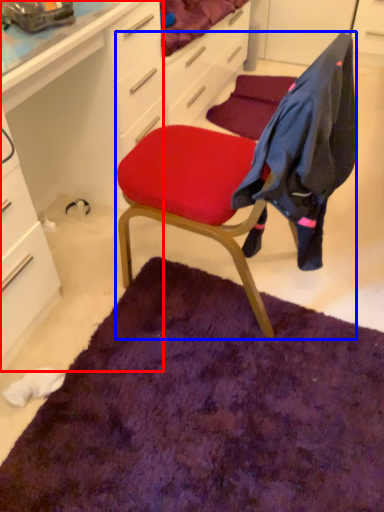
Question: Which object is further to the camera taking this photo, computer desk (highlighted by a red box) or chair (highlighted by a blue box)?

Choices:
 (A) computer desk
 (B) chair

Answer: (B)